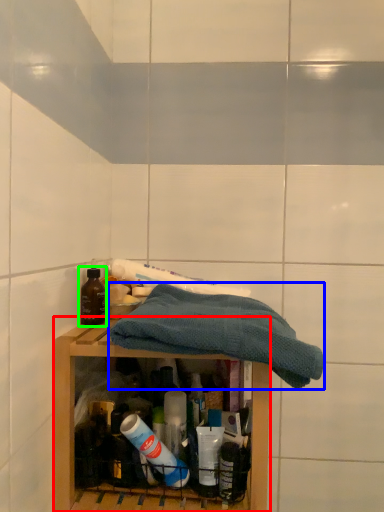
Question: Which object is the closest to the shelf (highlighted by a red box)? Choose among these: towel (highlighted by a blue box) or bottle (highlighted by a green box).

Choices:
 (A) towel
 (B) bottle

Answer: (A)